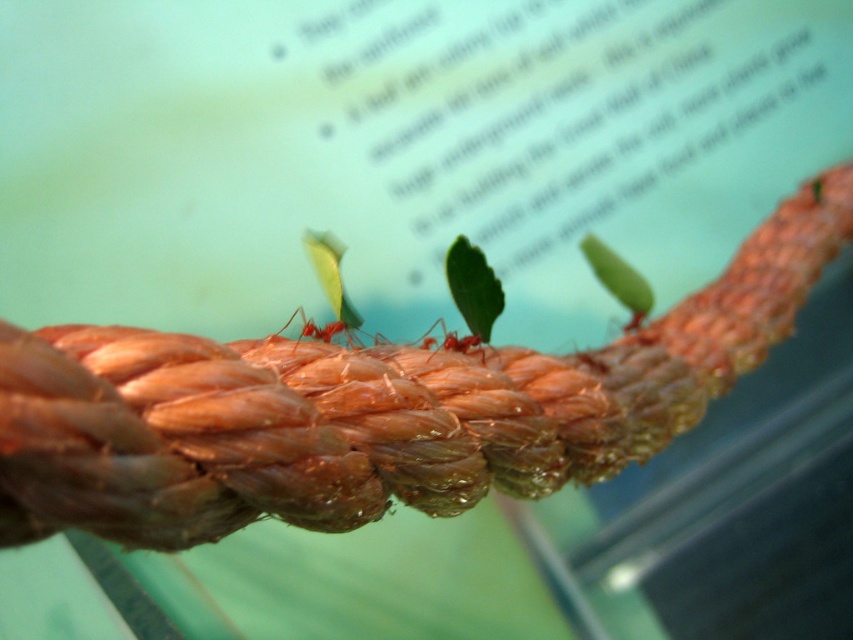
From the picture: You are a tiny explorer standing on the thick, reddish brown rope. You see two points marked on the rope. Which point is closer to you, point (286, 323) or point (451, 339)?

Point (286, 323) is closer to the viewer than point (451, 339).

Based on the photo, you are an entomologist observing the ants on the thick, reddish brown rope. You notice two ants labeled as matte red ant at center and red matte ant at center. Which one is located to the left?

The matte red ant at center is positioned on the left side of red matte ant at center, so the matte red ant at center is the one located to the left.

You are a photographer holding a camera 24.43 inches away from the matte red ant at center. You want to capture a closeup shot of the ant while keeping the blurred text in the background. Is the current distance sufficient to ensure the ant is in focus?

The distance between the matte red ant at center and the camera is exactly 24.43 inches. This distance is sufficient to ensure the ant is in focus while maintaining the blurred background effect for the text.